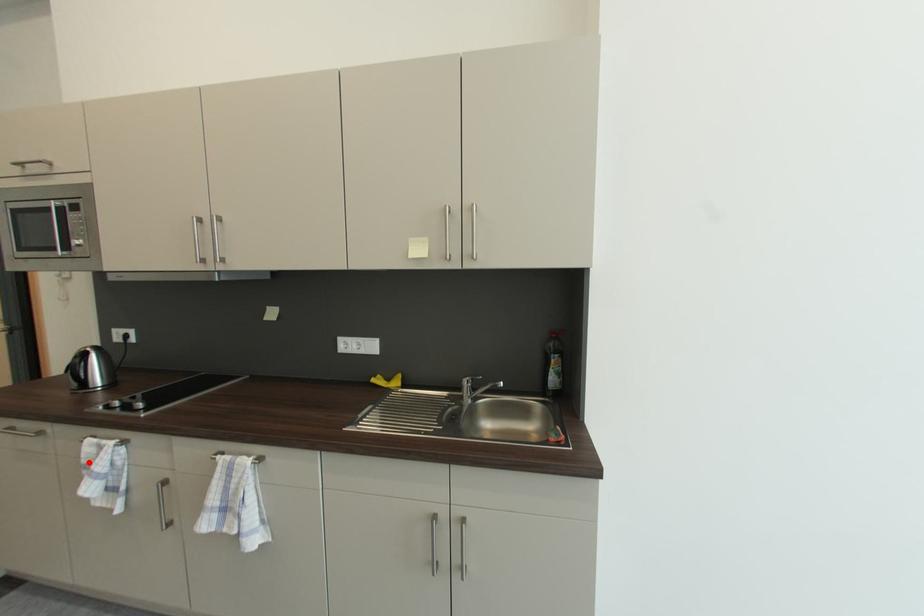
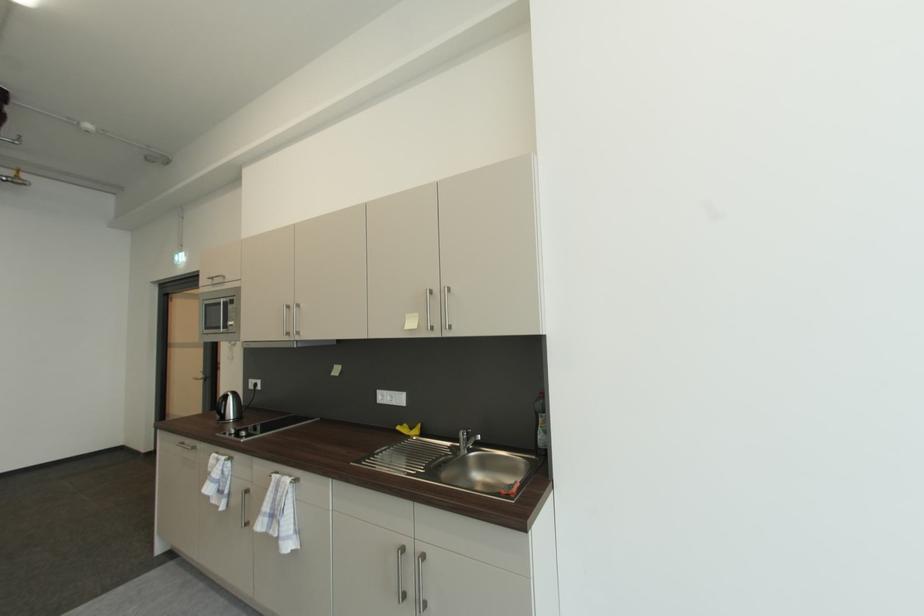
Question: I am providing you with two images of the same scene from different viewpoints. In image1, a red point is highlighted. Considering the same 3D point in image2, which of the following is correct?

Choices:
 (A) It is closer
 (B) It is farther

Answer: (B)